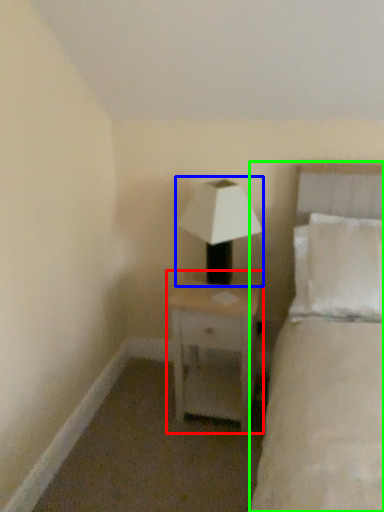
Question: Considering the real-world distances, which object is farthest from nightstand (highlighted by a red box)? lamp (highlighted by a blue box) or bed (highlighted by a green box)?

Choices:
 (A) lamp
 (B) bed

Answer: (B)